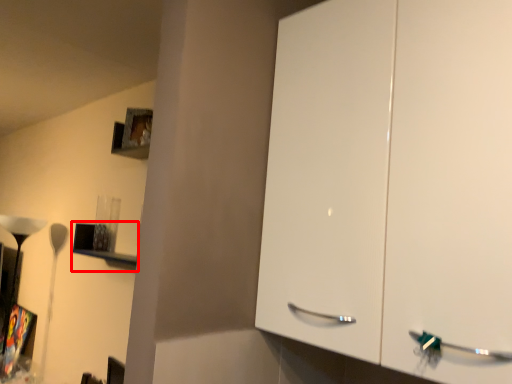
Question: Where is shelf (annotated by the red box) located in relation to lamp in the image?

Choices:
 (A) right
 (B) left

Answer: (A)